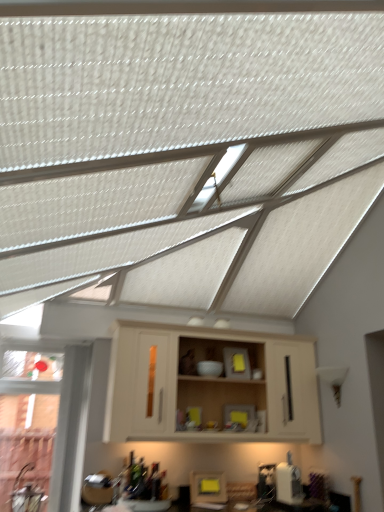
Question: Can you confirm if yellow matte frame at lower center is positioned to the left of beige wood cabinet at center?

Choices:
 (A) no
 (B) yes

Answer: (B)

Question: Considering the relative sizes of yellow matte frame at lower center and beige wood cabinet at center in the image provided, is yellow matte frame at lower center wider than beige wood cabinet at center?

Choices:
 (A) yes
 (B) no

Answer: (B)

Question: Can you confirm if yellow matte frame at lower center is bigger than beige wood cabinet at center?

Choices:
 (A) no
 (B) yes

Answer: (A)

Question: Considering the relative sizes of yellow matte frame at lower center and beige wood cabinet at center in the image provided, is yellow matte frame at lower center thinner than beige wood cabinet at center?

Choices:
 (A) no
 (B) yes

Answer: (B)

Question: Is yellow matte frame at lower center closer to camera compared to beige wood cabinet at center?

Choices:
 (A) no
 (B) yes

Answer: (A)

Question: Is yellow matte frame at lower center not inside beige wood cabinet at center?

Choices:
 (A) no
 (B) yes

Answer: (B)

Question: Does beige wood cabinet at center have a lesser height compared to yellow matte frame at lower center?

Choices:
 (A) yes
 (B) no

Answer: (B)

Question: Is beige wood cabinet at center smaller than yellow matte frame at lower center?

Choices:
 (A) yes
 (B) no

Answer: (B)

Question: Considering the relative positions of beige wood cabinet at center and yellow matte frame at lower center in the image provided, is beige wood cabinet at center to the left of yellow matte frame at lower center from the viewer's perspective?

Choices:
 (A) yes
 (B) no

Answer: (B)

Question: Considering the relative sizes of beige wood cabinet at center and yellow matte frame at lower center in the image provided, is beige wood cabinet at center bigger than yellow matte frame at lower center?

Choices:
 (A) no
 (B) yes

Answer: (B)

Question: From the image's perspective, is beige wood cabinet at center on yellow matte frame at lower center?

Choices:
 (A) no
 (B) yes

Answer: (B)

Question: Is beige wood cabinet at center turned away from yellow matte frame at lower center?

Choices:
 (A) no
 (B) yes

Answer: (A)

Question: In terms of width, does yellow matte frame at lower center look wider or thinner when compared to beige wood cabinet at center?

Choices:
 (A) thin
 (B) wide

Answer: (A)